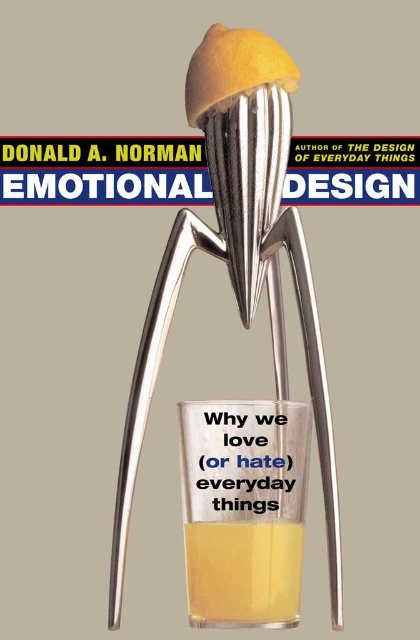
Is polished metal juicer at center to the left of yellow translucent liquid at center from the viewer's perspective?

Correct, you'll find polished metal juicer at center to the left of yellow translucent liquid at center.

Consider the image. Which of these two, polished metal juicer at center or yellow translucent liquid at center, stands shorter?

Standing shorter between the two is yellow translucent liquid at center.

In order to click on polished metal juicer at center in this screenshot , I will do (273, 355).

Is point (254, 237) less distant than point (204, 113)?

Yes, point (254, 237) is in front of point (204, 113).

Between polished metal juicer at center and yellow matte lemon at center, which one has less height?

yellow matte lemon at center is shorter.

The height and width of the screenshot is (640, 420). What are the coordinates of `polished metal juicer at center` in the screenshot? It's located at (273, 355).

Does yellow translucent liquid at lower center have a lesser height compared to yellow matte lemon at center?

Yes.

Is yellow translucent liquid at lower center wider than yellow matte lemon at center?

No, yellow translucent liquid at lower center is not wider than yellow matte lemon at center.

Measure the distance between point (280, 557) and camera.

Point (280, 557) and camera are 7.90 inches apart.

Find the location of a particular element. The image size is (420, 640). yellow translucent liquid at lower center is located at coordinates (243, 573).